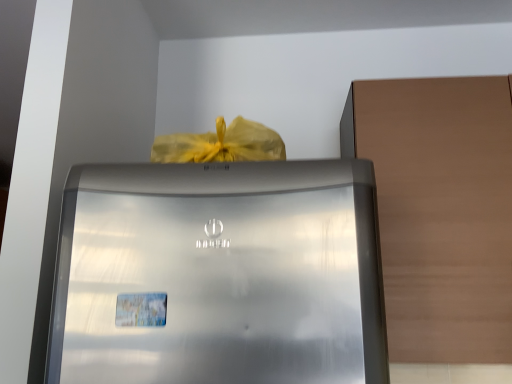
This screenshot has height=384, width=512. Describe the element at coordinates (440, 211) in the screenshot. I see `matte brown cabinet at right` at that location.

What is the approximate height of matte brown cabinet at right?

Result: matte brown cabinet at right is 28.25 inches in height.

You are a GUI agent. You are given a task and a screenshot of the screen. Output one action in this format:
    pyautogui.click(x=<x>, y=<y>)
    Task: Click on the matte brown cabinet at right
    The height and width of the screenshot is (384, 512).
    Given the screenshot: What is the action you would take?
    pyautogui.click(x=440, y=211)

This screenshot has height=384, width=512. What are the coordinates of `matte brown cabinet at right` in the screenshot? It's located at (440, 211).